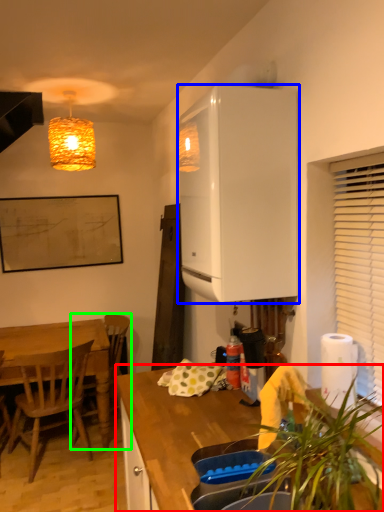
Question: Considering the real-world distances, which object is closest to countertop (highlighted by a red box)? cabinetry (highlighted by a blue box) or chair (highlighted by a green box).

Choices:
 (A) cabinetry
 (B) chair

Answer: (A)